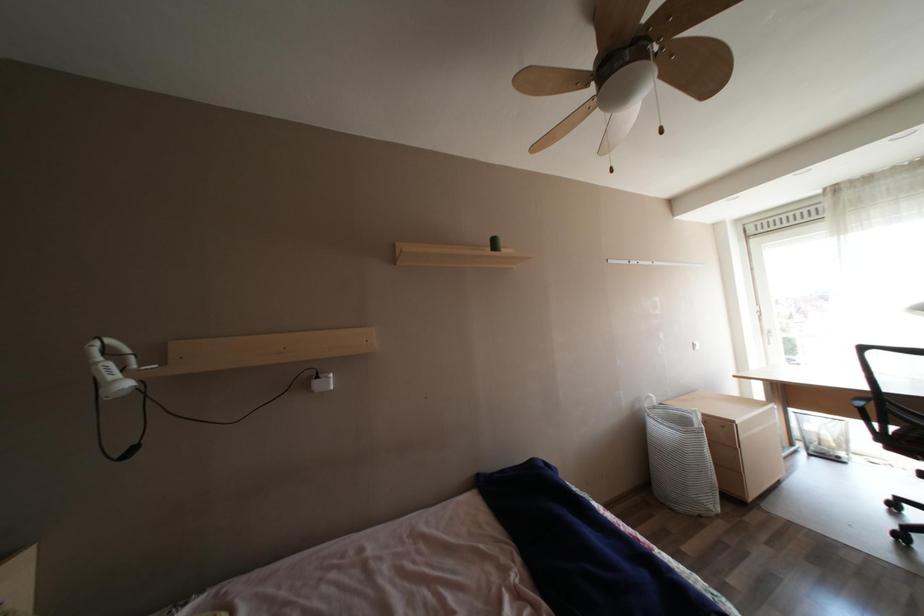
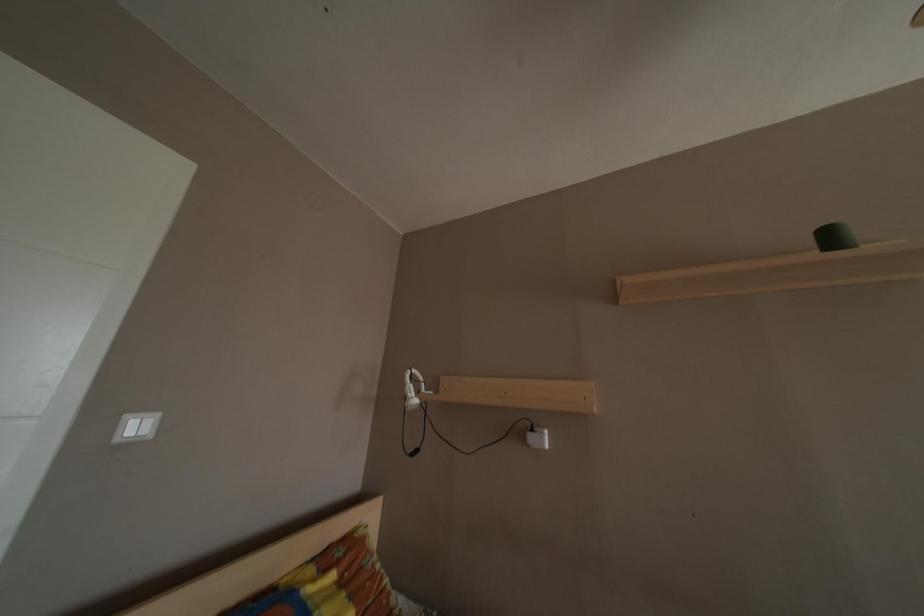
Question: How did the camera likely rotate?

Choices:
 (A) Left
 (B) Right
 (C) Up
 (D) Down

Answer: (A)